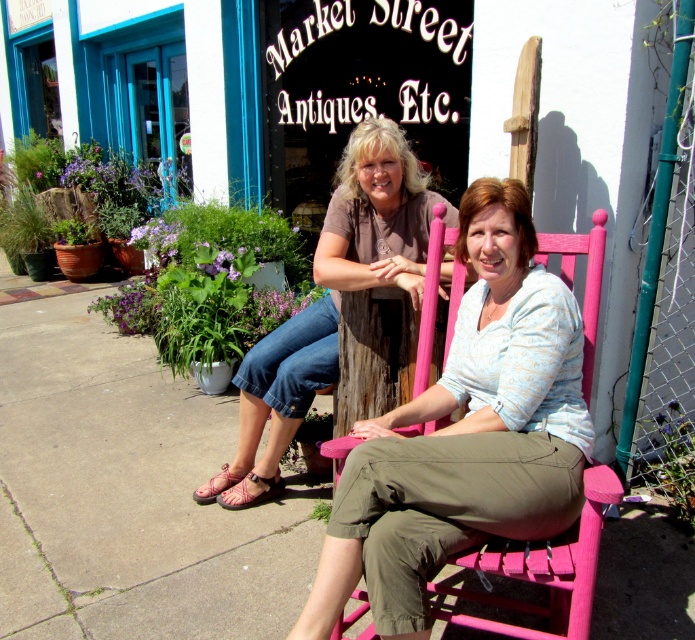
You are taking a photo of two women sitting outside Market Street Antiques, Etc. The scene includes a matte brown shirt at center and a pink painted wood rocking chair at center. Which object is located to the left of the other?

The matte brown shirt at center is positioned on the left side of pink painted wood rocking chair at center.

You are a photographer setting up a shoot at Market Street Antiques, Etc. You need to place a large camera bag next to the matte brown shirt at center and the pink painted wood rocking chair at center. Which object should you place the bag next to if you want it to look proportionally balanced?

The matte brown shirt at center has a larger size compared to the pink painted wood rocking chair at center. To achieve a proportionally balanced look, place the large camera bag next to the pink painted wood rocking chair at center so that their sizes complement each other.

You are a photographer trying to capture both the matte brown shirt at center and the pink painted wood rocking chair at center in the same frame. Based on their heights, which object should you focus on to ensure both are fully visible?

The matte brown shirt at center is much taller than the pink painted wood rocking chair at center, so you should focus on the matte brown shirt at center to ensure both are fully visible in the frame.